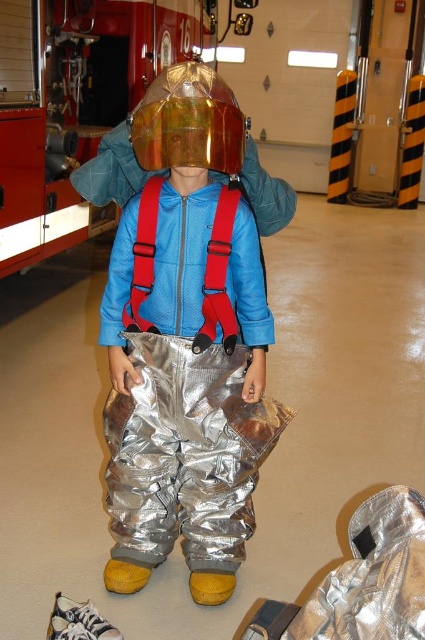
Question: Is brushed metal fire truck at upper center bigger than transparent plastic helmet at center?

Choices:
 (A) no
 (B) yes

Answer: (B)

Question: Among these objects, which one is farthest from the camera?

Choices:
 (A) silver reflective pants at center
 (B) transparent plastic helmet at center

Answer: (A)

Question: Does silver reflective pants at center appear on the right side of transparent plastic helmet at center?

Choices:
 (A) yes
 (B) no

Answer: (B)

Question: Is brushed metal fire truck at upper center above transparent plastic helmet at center?

Choices:
 (A) yes
 (B) no

Answer: (A)

Question: Based on their relative distances, which object is farther from the silver reflective pants at center?

Choices:
 (A) transparent plastic helmet at center
 (B) brushed metal fire truck at upper center

Answer: (B)

Question: Which point is closer to the camera taking this photo?

Choices:
 (A) (190, 99)
 (B) (53, 221)
 (C) (274, 193)

Answer: (A)